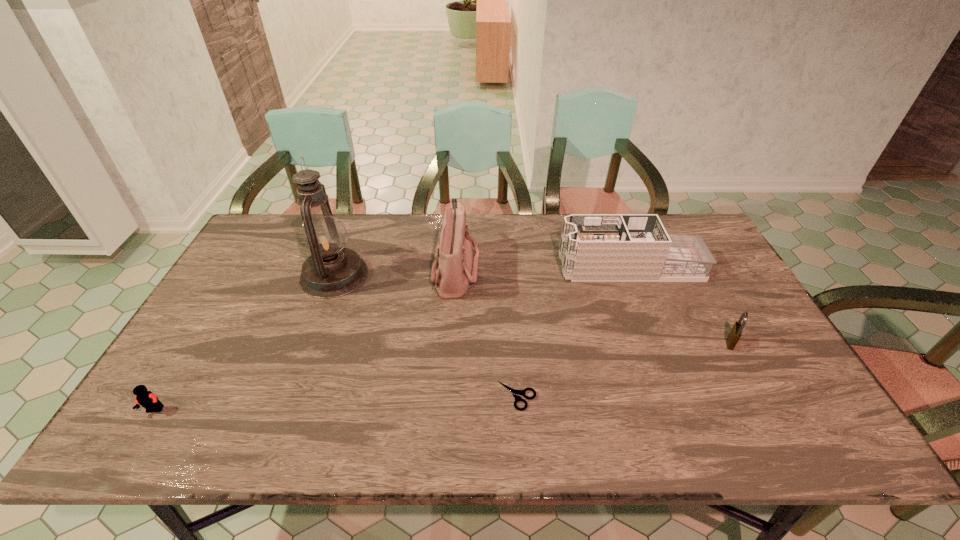
You are a GUI agent. You are given a task and a screenshot of the screen. Output one action in this format:
    pyautogui.click(x=<x>, y=<y>)
    Task: Click on the fifth object from right to left
    The image size is (960, 540).
    Given the screenshot: What is the action you would take?
    tap(331, 271)

Locate an element on the screen. the tallest object is located at coordinates (331, 271).

This screenshot has width=960, height=540. Find the location of `the third object from left to right`. the third object from left to right is located at coordinates (454, 270).

At what (x,y) coordinates should I click in order to perform the action: click on the fourth shortest object. Please return your answer as a coordinate pair (x, y). Looking at the image, I should click on (594, 247).

Image resolution: width=960 pixels, height=540 pixels. In order to click on the third nearest object in this screenshot , I will do `click(736, 331)`.

Locate an element on the screen. Image resolution: width=960 pixels, height=540 pixels. padlock is located at coordinates (736, 331).

This screenshot has height=540, width=960. I want to click on the leftmost object, so click(x=148, y=400).

I want to click on Lego, so click(148, 400).

Find the location of a particular element. the shortest object is located at coordinates [x=517, y=394].

This screenshot has width=960, height=540. Find the location of `the fourth object from left to right`. the fourth object from left to right is located at coordinates (517, 394).